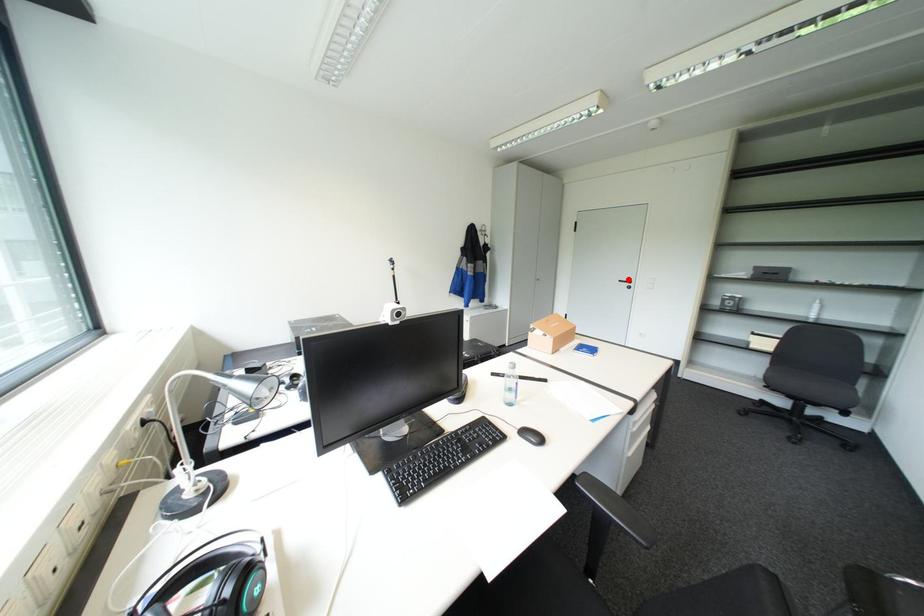
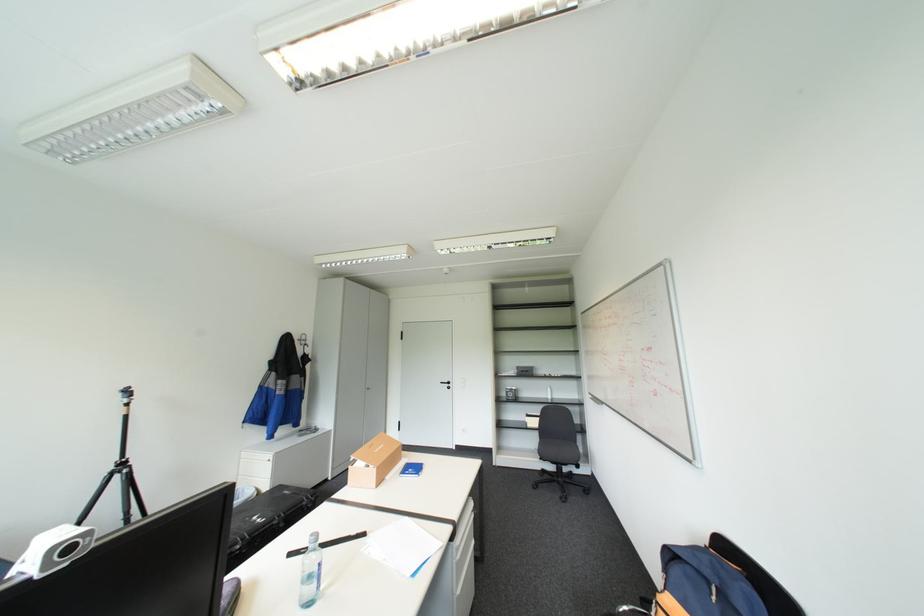
The point at the highlighted location is marked in the first image. Where is the corresponding point in the second image?

(450, 381)